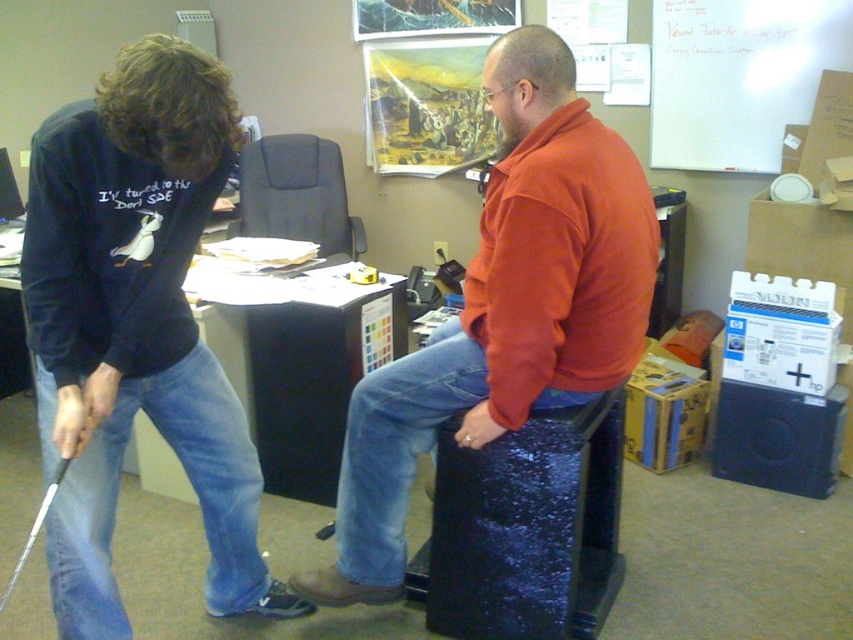
Which is more to the right, whiteboard at upper right or white glossy golf club at lower left?

Positioned to the right is whiteboard at upper right.

Does whiteboard at upper right come in front of white glossy golf club at lower left?

No, whiteboard at upper right is behind white glossy golf club at lower left.

I want to click on whiteboard at upper right, so click(x=738, y=77).

Image resolution: width=853 pixels, height=640 pixels. I want to click on whiteboard at upper right, so click(738, 77).

Between blue denim jeans at center and white glossy golf club at lower left, which one has less height?

Standing shorter between the two is white glossy golf club at lower left.

Is point (401, 435) positioned before point (42, 515)?

No, it is not.

Identify the location of blue denim jeans at center. (398, 445).

Identify the location of blue denim jeans at center. (398, 445).

Can you confirm if shiny blue stool at center is positioned below whiteboard at upper right?

Yes, shiny blue stool at center is below whiteboard at upper right.

This screenshot has width=853, height=640. Describe the element at coordinates (505, 308) in the screenshot. I see `shiny blue stool at center` at that location.

Does point (492, 182) come in front of point (766, 26)?

Yes, point (492, 182) is in front of point (766, 26).

In order to click on shiny blue stool at center in this screenshot , I will do `click(505, 308)`.